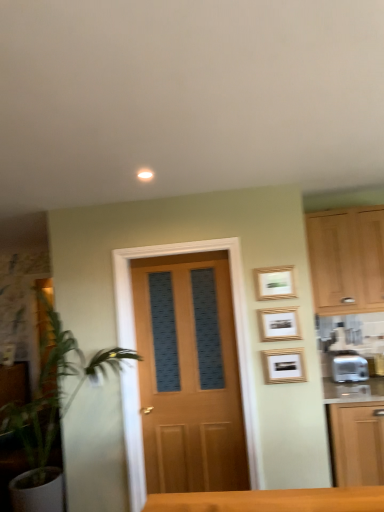
Find the location of a particular element. The height and width of the screenshot is (512, 384). free location above wooden door at center (from a real-world perspective) is located at coordinates (174, 257).